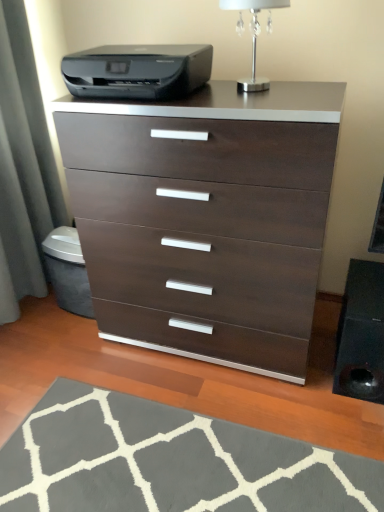
Question: Is silver metallic table lamp at upper center shorter than gray soft rug at lower center?

Choices:
 (A) yes
 (B) no

Answer: (B)

Question: Is silver metallic table lamp at upper center thinner than gray soft rug at lower center?

Choices:
 (A) no
 (B) yes

Answer: (B)

Question: Does silver metallic table lamp at upper center appear on the right side of gray soft rug at lower center?

Choices:
 (A) no
 (B) yes

Answer: (B)

Question: Can you confirm if silver metallic table lamp at upper center is wider than gray soft rug at lower center?

Choices:
 (A) no
 (B) yes

Answer: (A)

Question: Can you confirm if silver metallic table lamp at upper center is bigger than gray soft rug at lower center?

Choices:
 (A) yes
 (B) no

Answer: (B)

Question: Is silver metallic table lamp at upper center facing towards gray soft rug at lower center?

Choices:
 (A) no
 (B) yes

Answer: (A)

Question: From the image's perspective, is dark wood/finish chest of drawers at center on gray soft rug at lower center?

Choices:
 (A) no
 (B) yes

Answer: (B)

Question: From a real-world perspective, is dark wood/finish chest of drawers at center beneath gray soft rug at lower center?

Choices:
 (A) no
 (B) yes

Answer: (A)

Question: Is dark wood/finish chest of drawers at center outside gray soft rug at lower center?

Choices:
 (A) yes
 (B) no

Answer: (A)

Question: From the image's perspective, is dark wood/finish chest of drawers at center located beneath gray soft rug at lower center?

Choices:
 (A) yes
 (B) no

Answer: (B)

Question: Is the position of dark wood/finish chest of drawers at center less distant than that of gray soft rug at lower center?

Choices:
 (A) no
 (B) yes

Answer: (A)

Question: Is dark wood/finish chest of drawers at center next to gray soft rug at lower center?

Choices:
 (A) no
 (B) yes

Answer: (A)

Question: Is black plastic printer at upper center far from silver metallic table lamp at upper center?

Choices:
 (A) yes
 (B) no

Answer: (B)